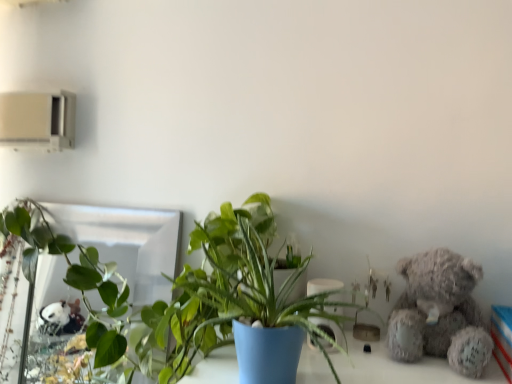
Question: Considering the relative sizes of silver reflective mirror at upper left and fuzzy gray teddy bear at right in the image provided, is silver reflective mirror at upper left wider than fuzzy gray teddy bear at right?

Choices:
 (A) no
 (B) yes

Answer: (A)

Question: Would you say silver reflective mirror at upper left contains fuzzy gray teddy bear at right?

Choices:
 (A) no
 (B) yes

Answer: (A)

Question: Is silver reflective mirror at upper left bigger than fuzzy gray teddy bear at right?

Choices:
 (A) no
 (B) yes

Answer: (B)

Question: From the image's perspective, does silver reflective mirror at upper left appear lower than fuzzy gray teddy bear at right?

Choices:
 (A) no
 (B) yes

Answer: (B)

Question: Can you confirm if silver reflective mirror at upper left is positioned to the left of fuzzy gray teddy bear at right?

Choices:
 (A) yes
 (B) no

Answer: (A)

Question: Looking at their shapes, would you say fuzzy gray teddy bear at right is wider or thinner than silver reflective mirror at upper left?

Choices:
 (A) wide
 (B) thin

Answer: (A)

Question: Which is correct: fuzzy gray teddy bear at right is inside silver reflective mirror at upper left, or outside of it?

Choices:
 (A) inside
 (B) outside

Answer: (B)

Question: In the image, is fuzzy gray teddy bear at right positioned in front of or behind silver reflective mirror at upper left?

Choices:
 (A) front
 (B) behind

Answer: (A)

Question: Is point (423, 289) closer or farther from the camera than point (41, 274)?

Choices:
 (A) farther
 (B) closer

Answer: (B)

Question: Would you say blue matte pot at center is to the left or to the right of fuzzy gray teddy bear at right in the picture?

Choices:
 (A) right
 (B) left

Answer: (B)

Question: Is blue matte pot at center taller or shorter than fuzzy gray teddy bear at right?

Choices:
 (A) tall
 (B) short

Answer: (A)

Question: Is blue matte pot at center in front of or behind fuzzy gray teddy bear at right in the image?

Choices:
 (A) front
 (B) behind

Answer: (A)

Question: Considering the positions of point (214, 215) and point (404, 268), is point (214, 215) closer or farther from the camera than point (404, 268)?

Choices:
 (A) farther
 (B) closer

Answer: (A)

Question: In terms of height, does fuzzy gray teddy bear at right look taller or shorter compared to blue matte pot at center?

Choices:
 (A) tall
 (B) short

Answer: (B)

Question: Which is correct: fuzzy gray teddy bear at right is inside blue matte pot at center, or outside of it?

Choices:
 (A) inside
 (B) outside

Answer: (B)